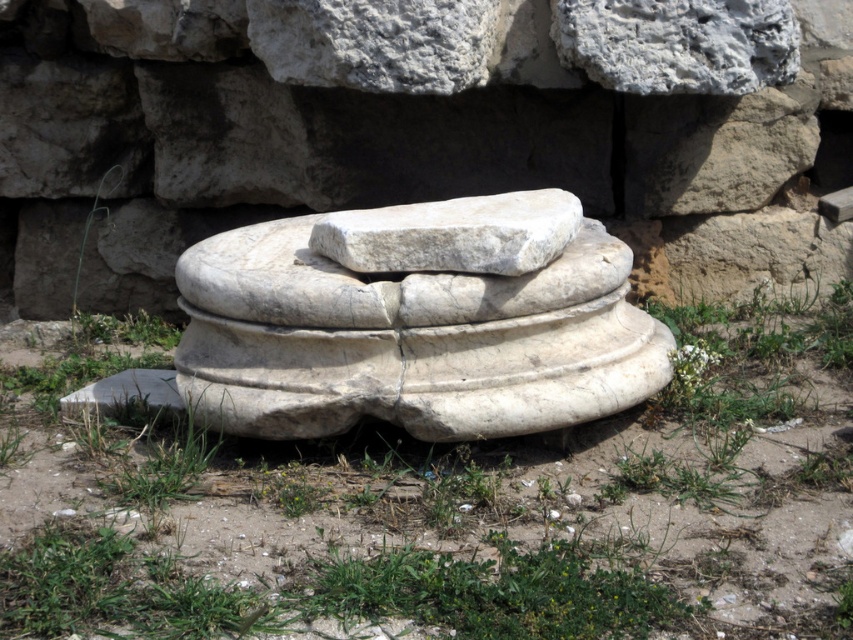
You are standing in front of the white marble sculpture at center and want to place a small potted plant on the green grass at center. In which direction should you move the plant relative to the sculpture?

The green grass at center is positioned on the left side of the white marble sculpture at center, so you should move the plant to the left relative to the sculpture.

You are standing at the point marked as point (437, 504) in the image. What do you see directly beneath your feet?

You see green grass at center directly beneath your feet at point (437, 504).

You are standing in front of the stone structure and want to walk towards the point that is closer to you. Which point should you walk towards, point [469,588] or point [590,252]?

Point [469,588] is in front of point [590,252], so you should walk towards point [469,588] as it is closer to you.